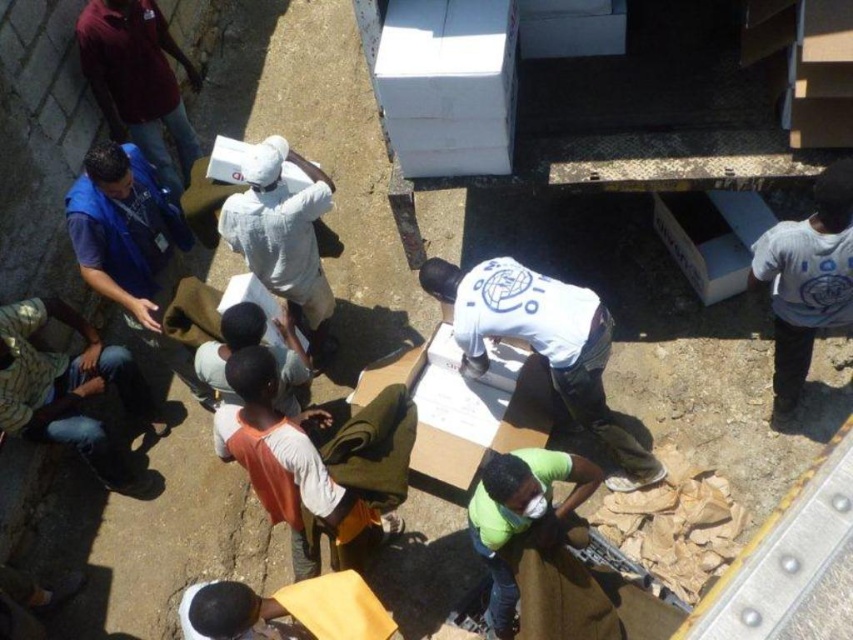
Question: Does white matte shirt at center appear on the left side of white cotton shirt at lower right?

Choices:
 (A) yes
 (B) no

Answer: (A)

Question: Is camouflage fabric shirt at lower left to the right of white cotton shirt at center from the viewer's perspective?

Choices:
 (A) no
 (B) yes

Answer: (A)

Question: Estimate the real-world distances between objects in this image. Which object is farther from the blue fabric shirt at upper left?

Choices:
 (A) blue fabric vest at upper left
 (B) white matte shirt at center
 (C) orange fabric shirt at center
 (D) white cardboard box at lower right

Answer: (D)

Question: Which object is closer to the camera taking this photo?

Choices:
 (A) orange fabric shirt at center
 (B) blue fabric shirt at upper left
 (C) cardboard box at center
 (D) camouflage fabric shirt at lower left

Answer: (A)

Question: Does orange fabric bag at center have a lesser width compared to white cotton shirt at lower right?

Choices:
 (A) no
 (B) yes

Answer: (A)

Question: Which point appears farthest from the camera in this image?

Choices:
 (A) (508, 289)
 (B) (224, 340)
 (C) (73, 209)

Answer: (C)